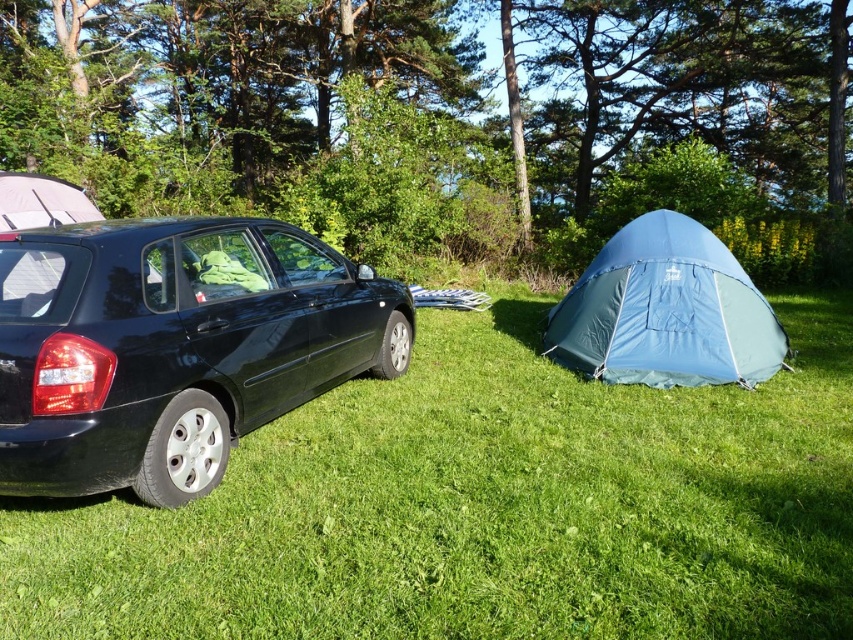
Question: Can you confirm if green grass at lower left is smaller than blue fabric tent at right?

Choices:
 (A) yes
 (B) no

Answer: (A)

Question: Among these objects, which one is farthest from the camera?

Choices:
 (A) blue fabric tent at right
 (B) green grass at lower left
 (C) matte gray tent at left

Answer: (C)

Question: Considering the real-world distances, which object is farthest from the blue fabric tent at right?

Choices:
 (A) green grass at lower left
 (B) glossy black car at left

Answer: (B)

Question: Does green grass at lower left have a larger size compared to glossy black car at left?

Choices:
 (A) yes
 (B) no

Answer: (B)

Question: Is green grass at lower left thinner than blue fabric tent at right?

Choices:
 (A) yes
 (B) no

Answer: (B)

Question: Which point is closer to the camera?

Choices:
 (A) (599, 360)
 (B) (39, 209)
 (C) (128, 381)
 (D) (492, 436)

Answer: (C)